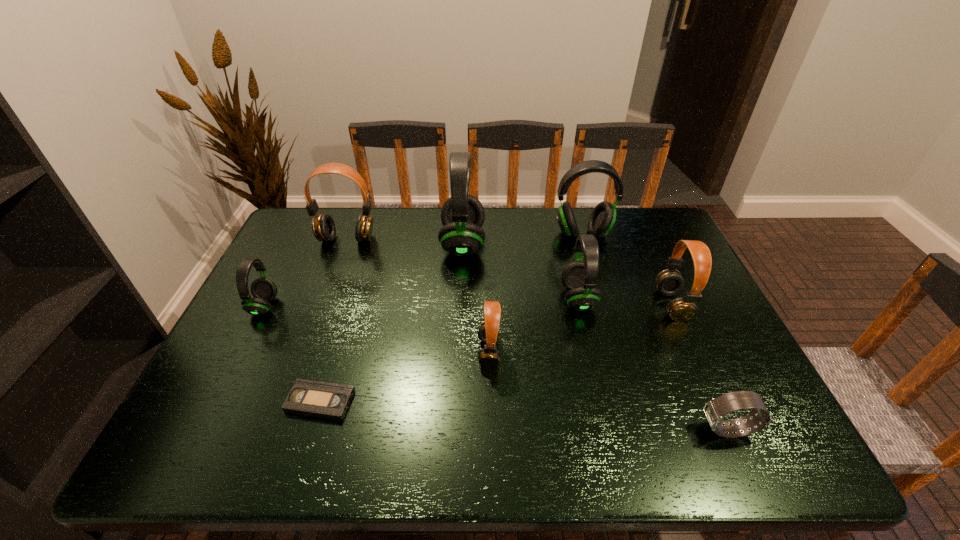
Locate an element on the screen. The width and height of the screenshot is (960, 540). free space between the smallest brown headset and the watch is located at coordinates (608, 390).

Image resolution: width=960 pixels, height=540 pixels. I want to click on free area in between the smallest black headset and the farthest brown headset, so click(305, 273).

Identify the location of object that is the fourth closest to the second biggest brown headset. This screenshot has width=960, height=540. (488, 332).

The image size is (960, 540). Identify the location of the closest object relative to the second smallest black headset. (602, 219).

Where is `the fifth closest headset relative to the smallest black headset`? The height and width of the screenshot is (540, 960). the fifth closest headset relative to the smallest black headset is located at coordinates (602, 219).

Find the location of a particular element. headset that can be found as the second closest to the tallest object is located at coordinates (579, 278).

Select which black headset is the third closest to the biggest black headset. Please provide its 2D coordinates. Your answer should be formatted as a tuple, i.e. [(x, y)], where the tuple contains the x and y coordinates of a point satisfying the conditions above.

[(263, 289)]

Find the location of a particular element. The height and width of the screenshot is (540, 960). black headset that is the nearest to the videotape is located at coordinates (263, 289).

Where is `brown headset that stands as the closest to the third black headset from right to left`? brown headset that stands as the closest to the third black headset from right to left is located at coordinates 323,226.

Choose which brown headset is the second nearest neighbor to the second shortest object. Please provide its 2D coordinates. Your answer should be formatted as a tuple, i.e. [(x, y)], where the tuple contains the x and y coordinates of a point satisfying the conditions above.

[(488, 332)]